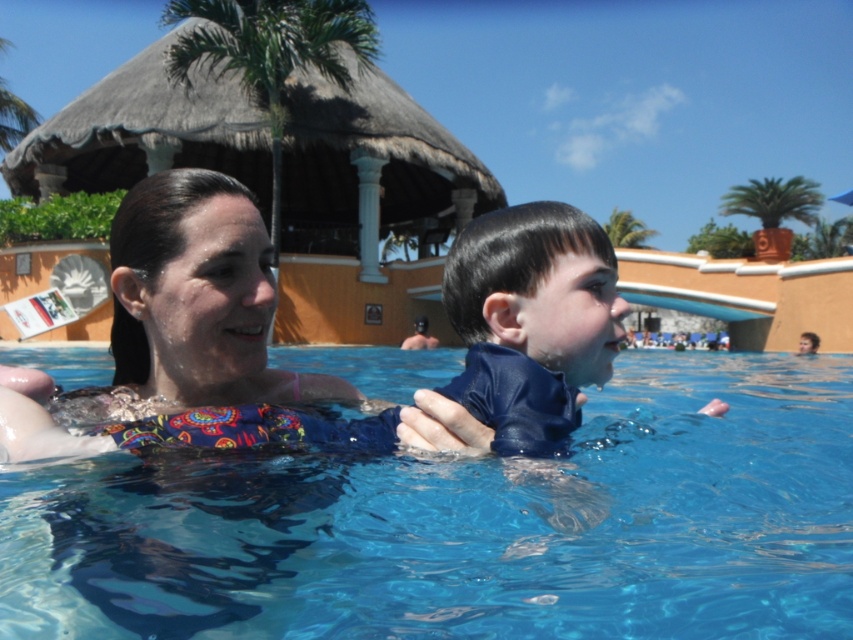
Consider the image. You are a swim instructor observing the scene. You see the transparent blue water at center and the blue matte wetsuit at center. Which object is located below the other?

The transparent blue water at center is positioned under blue matte wetsuit at center, so the water is below the wetsuit.

You are standing at the point marked as point [469,525] in the image. What is the color of the object directly beneath your feet?

The transparent blue water at center is located at point [469,525], so the color beneath your feet would be blue.

You are a lifeguard on duty and need to ensure safety. The transparent blue water at center and the blue matte wetsuit at center are both in your line of sight. Which one is bigger in size?

The transparent blue water at center has a larger size compared to the blue matte wetsuit at center, so the water is bigger in size.